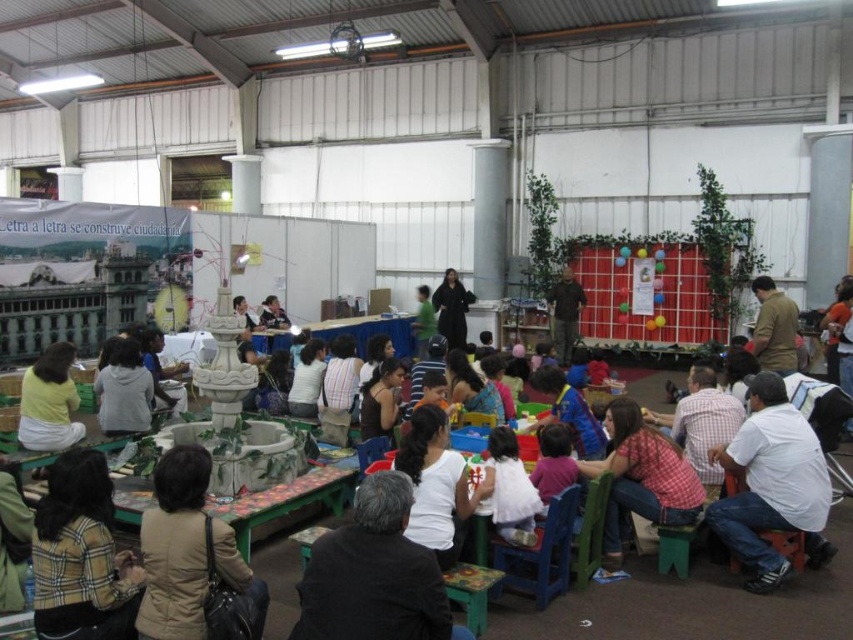
Question: Which point is farther to the camera?

Choices:
 (A) (276, 438)
 (B) (173, 396)
 (C) (339, 388)

Answer: (B)

Question: Which of these objects is positioned farthest from the brown cotton jacket at lower left?

Choices:
 (A) white cotton shirt at center
 (B) white matte shirt at center
 (C) striped fabric shirt at center

Answer: (C)

Question: Does white cotton shirt at center have a larger size compared to light brown fabric shirt at center?

Choices:
 (A) yes
 (B) no

Answer: (B)

Question: Does light gray hoodie at center have a smaller size compared to green fabric shirt at center?

Choices:
 (A) yes
 (B) no

Answer: (B)

Question: Does matte yellow shirt at left have a larger size compared to light gray hoodie at center?

Choices:
 (A) yes
 (B) no

Answer: (B)

Question: Which point is farther to the camera?

Choices:
 (A) brown cotton jacket at lower left
 (B) green plastic table at lower left
 (C) brown leather jacket at center

Answer: (C)